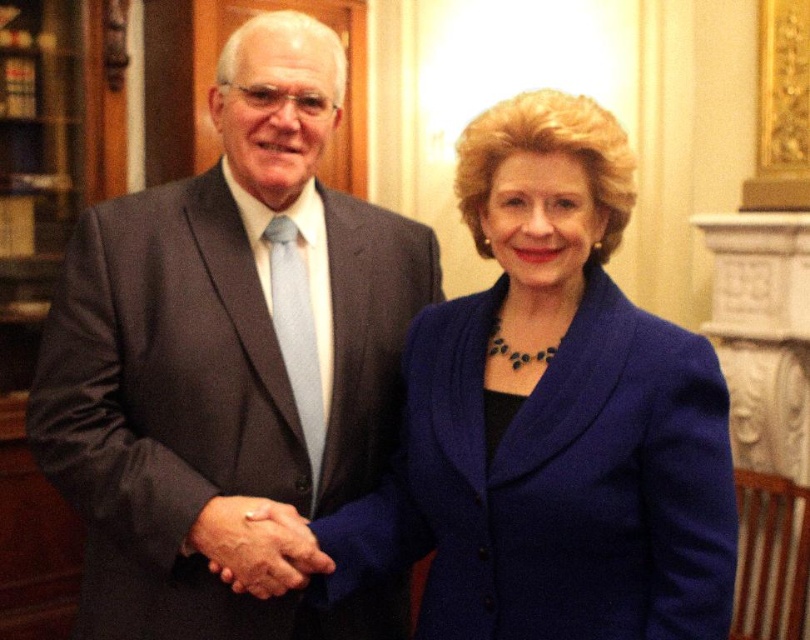
Question: Which of these objects is positioned farthest from the smooth skin handshake at center?

Choices:
 (A) matte gray suit at center
 (B) blue woolen blazer at center

Answer: (B)

Question: Which object appears closest to the camera in this image?

Choices:
 (A) blue woolen blazer at center
 (B) matte gray suit at center
 (C) smooth skin handshake at center

Answer: (A)

Question: Can you confirm if matte gray suit at center is positioned above blue woolen blazer at center?

Choices:
 (A) yes
 (B) no

Answer: (A)

Question: Is matte gray suit at center positioned behind blue woolen blazer at center?

Choices:
 (A) yes
 (B) no

Answer: (A)

Question: Can you confirm if blue woolen blazer at center is smaller than smooth skin handshake at center?

Choices:
 (A) yes
 (B) no

Answer: (B)

Question: Which of these objects is positioned farthest from the blue woolen blazer at center?

Choices:
 (A) smooth skin handshake at center
 (B) matte gray suit at center

Answer: (A)